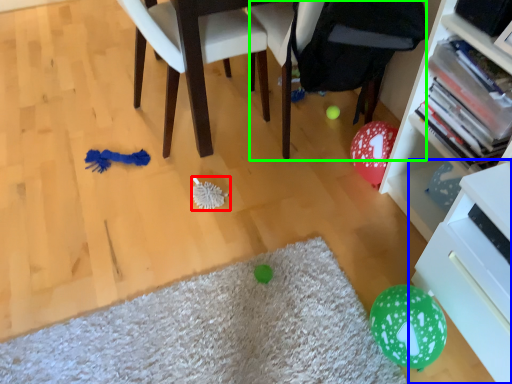
Question: Considering the real-world distances, which object is farthest from brush (highlighted by a red box)? shelf (highlighted by a blue box) or bean bag chair (highlighted by a green box)?

Choices:
 (A) shelf
 (B) bean bag chair

Answer: (A)